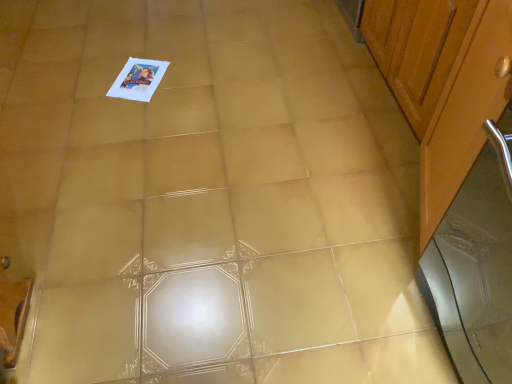
Question: Considering the positions of wooden cabinet at right, placed as the 1th cabinetry when sorted from front to back, and silver metallic screen door at right in the image, is wooden cabinet at right, placed as the 1th cabinetry when sorted from front to back, taller or shorter than silver metallic screen door at right?

Choices:
 (A) tall
 (B) short

Answer: (A)

Question: Do you think wooden cabinet at right, the second cabinetry when ordered from back to front, is within silver metallic screen door at right, or outside of it?

Choices:
 (A) inside
 (B) outside

Answer: (B)

Question: Which is nearer to the wooden cabinet at right, the 1th cabinetry viewed from the back?

Choices:
 (A) wooden cabinet at right, the second cabinetry when ordered from back to front
 (B) silver metallic screen door at right

Answer: (A)

Question: Which of these objects is positioned farthest from the wooden cabinet at right, the 1th cabinetry viewed from the back?

Choices:
 (A) wooden cabinet at right, the second cabinetry when ordered from back to front
 (B) silver metallic screen door at right

Answer: (B)